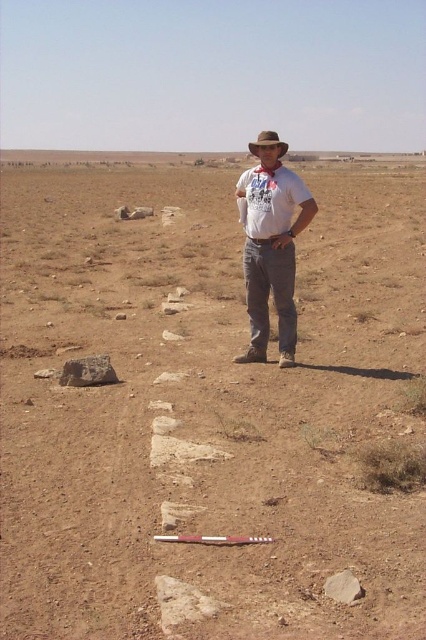
Question: Is matte white t-shirt at center bigger than brown felt cowboy hat at center?

Choices:
 (A) yes
 (B) no

Answer: (B)

Question: Does matte white t-shirt at center have a lesser width compared to brown felt cowboy hat at center?

Choices:
 (A) yes
 (B) no

Answer: (A)

Question: Which object is farther from the camera taking this photo?

Choices:
 (A) brown felt cowboy hat at center
 (B) matte white t-shirt at center

Answer: (A)

Question: Which of the following is the closest to the observer?

Choices:
 (A) brown felt cowboy hat at center
 (B) matte white t-shirt at center

Answer: (B)

Question: Considering the relative positions of matte white t-shirt at center and brown felt cowboy hat at center in the image provided, where is matte white t-shirt at center located with respect to brown felt cowboy hat at center?

Choices:
 (A) right
 (B) left

Answer: (B)